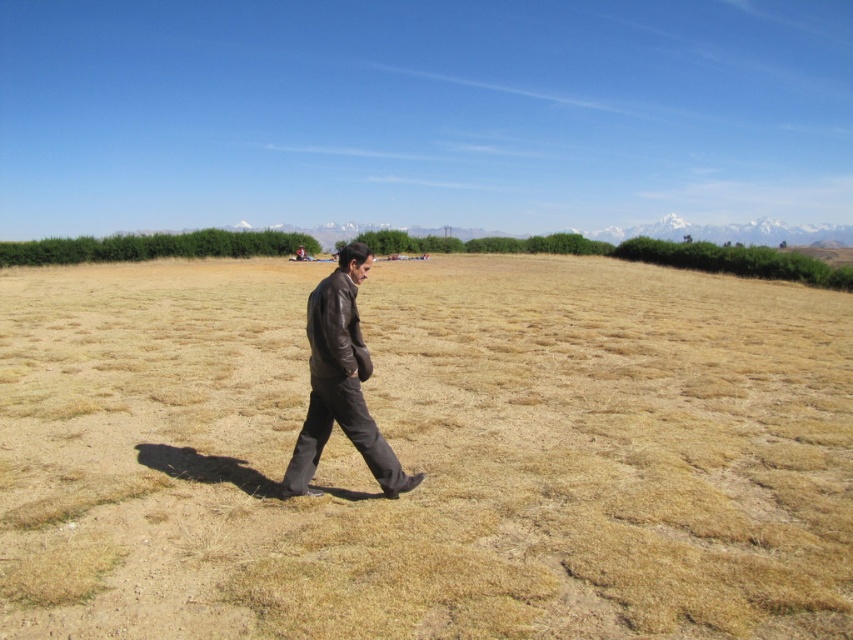
Is brown grass at center closer to camera compared to brown leather jacket at center?

Yes, brown grass at center is closer to the viewer.

Does brown grass at center come behind brown leather jacket at center?

No.

Who is more forward, (746, 304) or (315, 400)?

Point (315, 400) is in front.

Where is `brown grass at center`? brown grass at center is located at coordinates (426, 452).